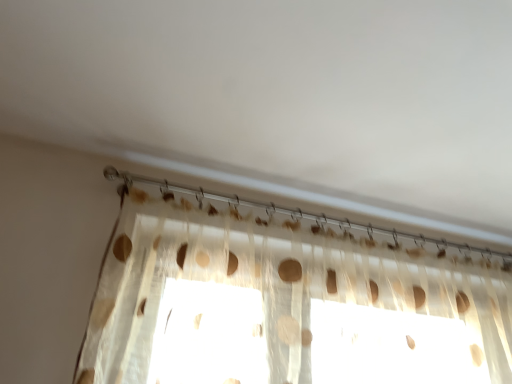
Question: Is translucent fabric curtain at upper center taller or shorter than translucent fabric at upper center?

Choices:
 (A) tall
 (B) short

Answer: (A)

Question: In terms of size, does translucent fabric curtain at upper center appear bigger or smaller than translucent fabric at upper center?

Choices:
 (A) big
 (B) small

Answer: (A)

Question: In the image, is translucent fabric curtain at upper center on the left side or the right side of translucent fabric at upper center?

Choices:
 (A) right
 (B) left

Answer: (A)

Question: Is point (272, 203) closer or farther from the camera than point (202, 193)?

Choices:
 (A) farther
 (B) closer

Answer: (A)

Question: Looking at their shapes, would you say translucent fabric at upper center is wider or thinner than translucent fabric curtain at upper center?

Choices:
 (A) wide
 (B) thin

Answer: (B)

Question: From the image's perspective, is translucent fabric at upper center located above or below translucent fabric curtain at upper center?

Choices:
 (A) below
 (B) above

Answer: (B)

Question: From a real-world perspective, is translucent fabric at upper center above or below translucent fabric curtain at upper center?

Choices:
 (A) below
 (B) above

Answer: (B)